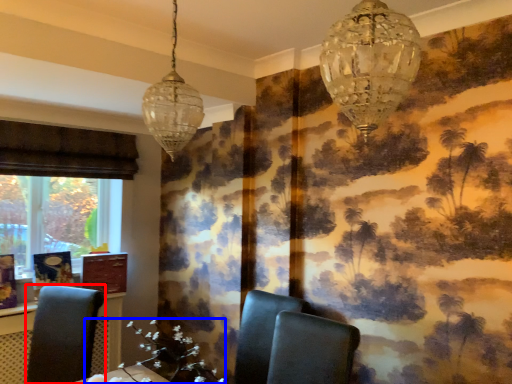
Question: Which object is closer to the camera taking this photo, chair (highlighted by a red box) or flower (highlighted by a blue box)?

Choices:
 (A) chair
 (B) flower

Answer: (B)